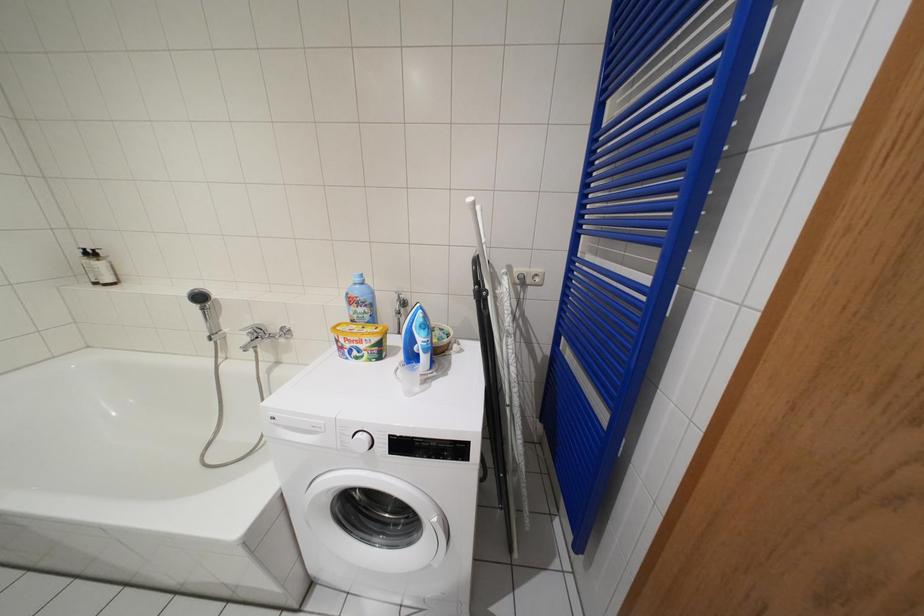
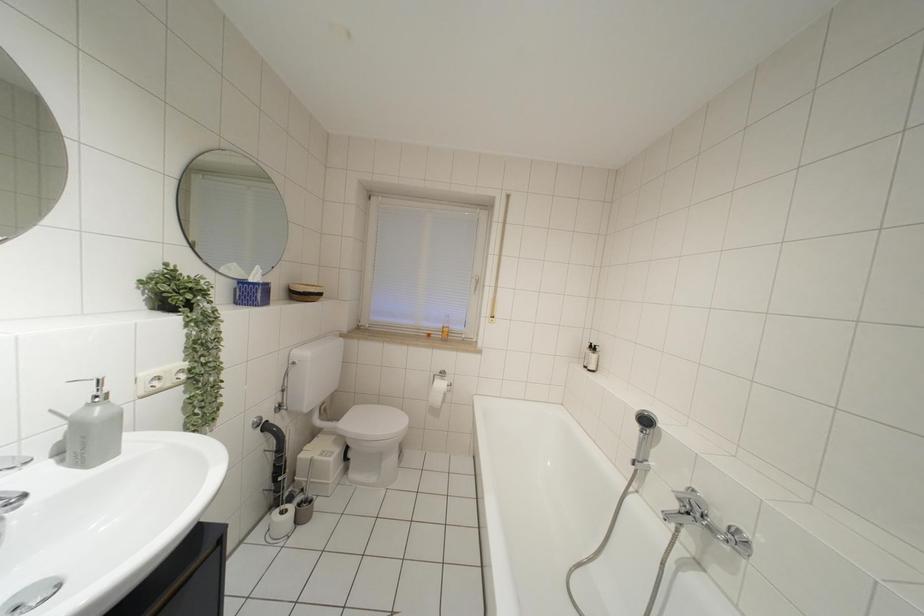
Question: How did the camera likely rotate?

Choices:
 (A) Left
 (B) Right
 (C) Up
 (D) Down

Answer: (A)